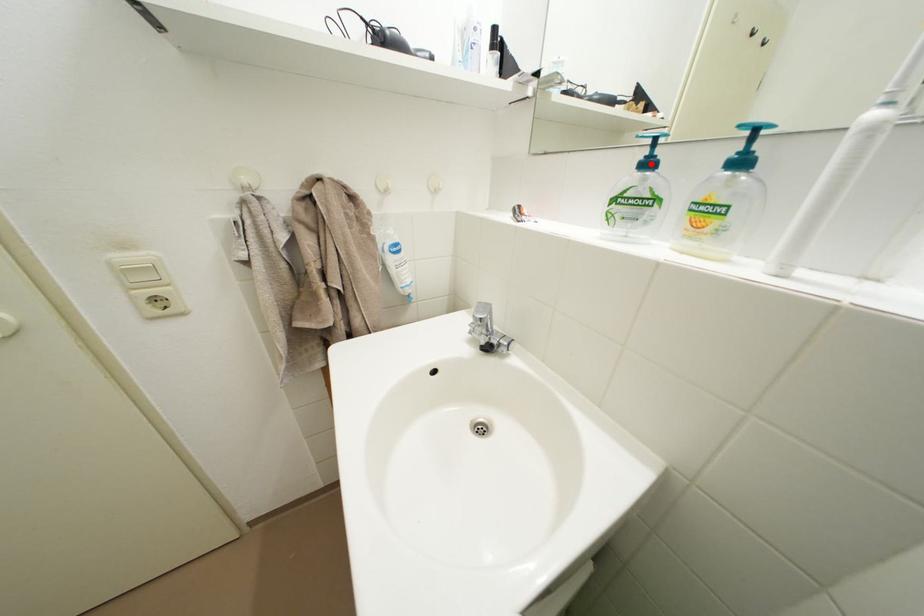
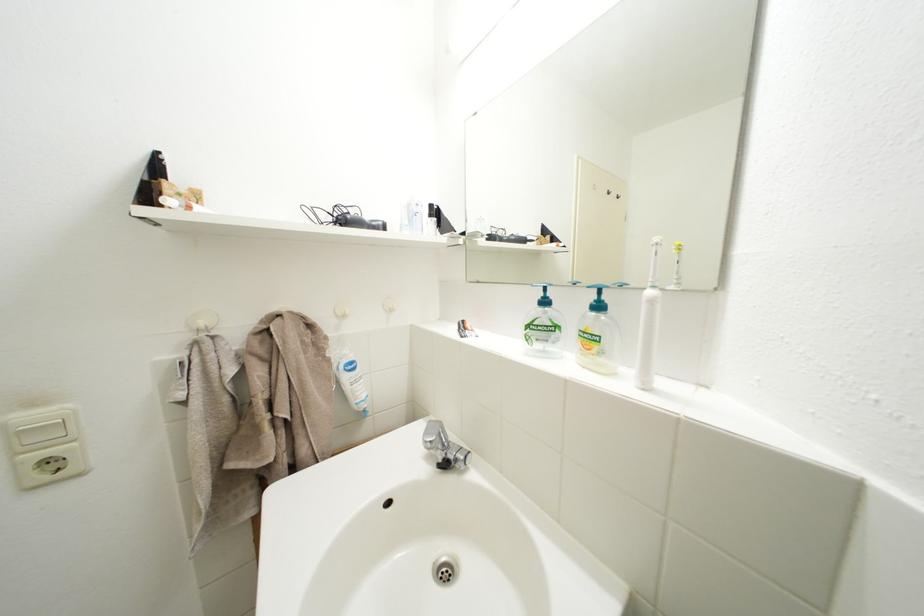
The point at the highlighted location is marked in the first image. Where is the corresponding point in the second image?

(550, 302)